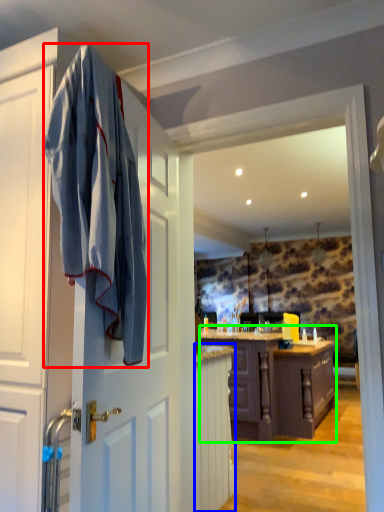
Question: Estimate the real-world distances between objects in this image. Which object is farther from bath towel (highlighted by a red box), cabinetry (highlighted by a blue box) or cabinetry (highlighted by a green box)?

Choices:
 (A) cabinetry
 (B) cabinetry

Answer: (B)